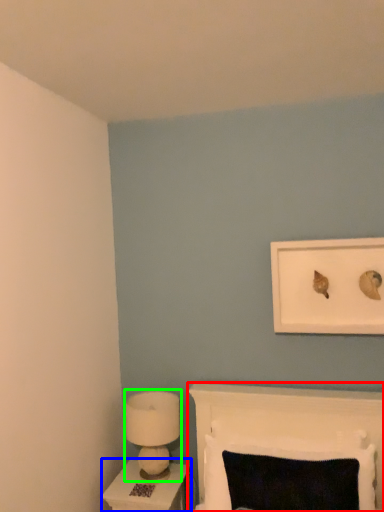
Question: Considering the real-world distances, which object is farthest from furniture (highlighted by a red box)? nightstand (highlighted by a blue box) or lamp (highlighted by a green box)?

Choices:
 (A) nightstand
 (B) lamp

Answer: (A)